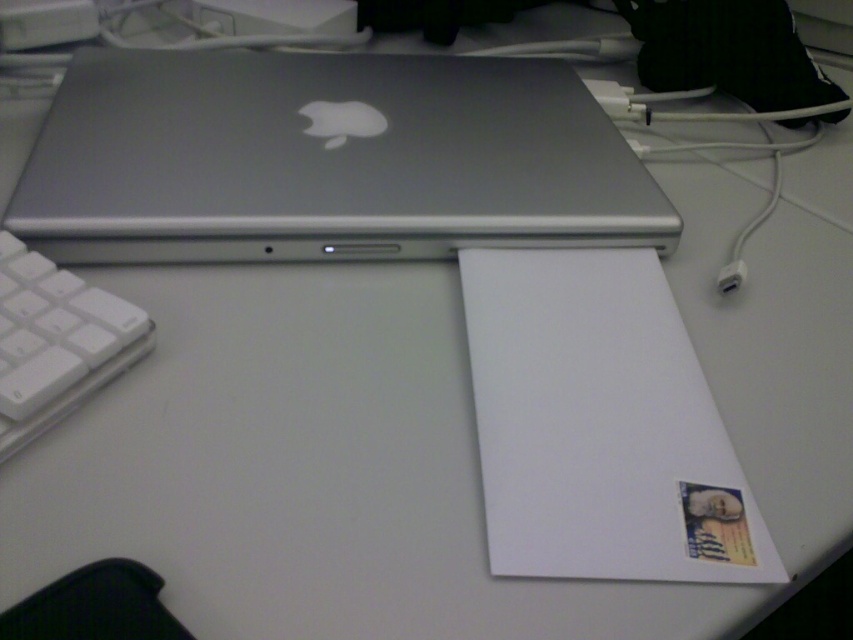
Can you confirm if satin silver laptop at upper center is thinner than white plastic plug at lower right?

No, satin silver laptop at upper center is not thinner than white plastic plug at lower right.

Which is more to the right, satin silver laptop at upper center or white plastic plug at lower right?

white plastic plug at lower right is more to the right.

Image resolution: width=853 pixels, height=640 pixels. Identify the location of satin silver laptop at upper center. (326, 160).

Looking at this image, between satin silver laptop at upper center and white plastic keyboard at lower left, which one is positioned higher?

satin silver laptop at upper center

Between point (625, 244) and point (20, 442), which one is positioned in front?

Positioned in front is point (20, 442).

Identify the location of satin silver laptop at upper center. This screenshot has height=640, width=853. (326, 160).

Measure the distance between point (44, 388) and camera.

Point (44, 388) is 14.70 inches from camera.

Consider the image. Who is shorter, white plastic keyboard at lower left or white plastic plug at lower right?

white plastic plug at lower right

Which is in front, point (28, 321) or point (743, 262)?

Positioned in front is point (28, 321).

The height and width of the screenshot is (640, 853). I want to click on white plastic keyboard at lower left, so click(x=56, y=340).